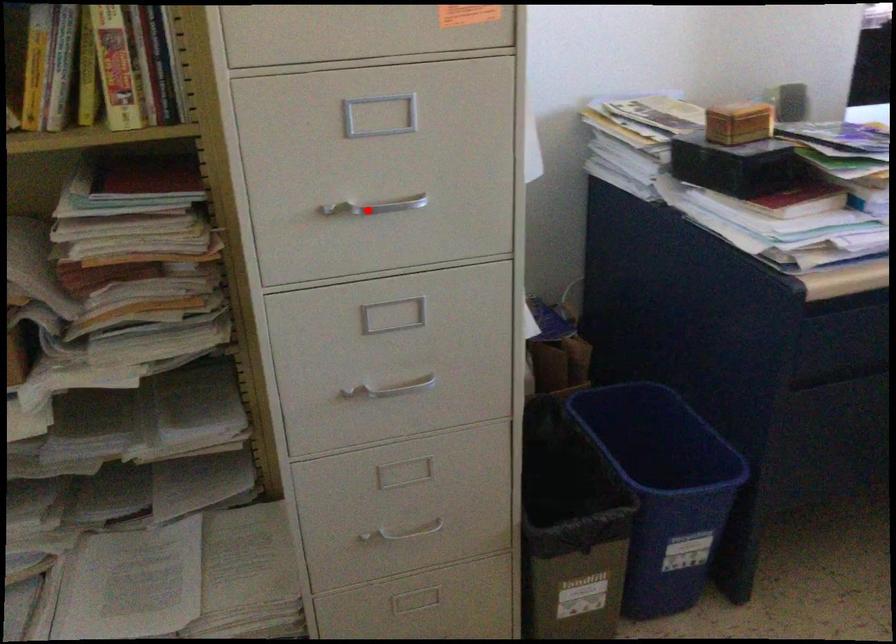
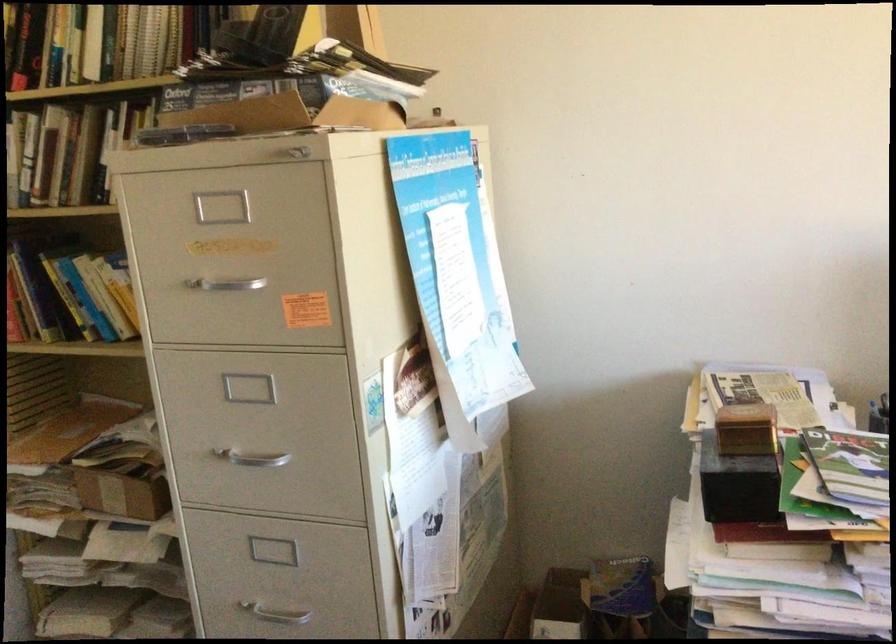
Question: I am providing you with two images of the same scene from different viewpoints. Image1 has a red point marked. In image2, the corresponding 3D location appears at what relative position? Reply with the corresponding letter.

Choices:
 (A) Closer
 (B) Farther

Answer: (B)